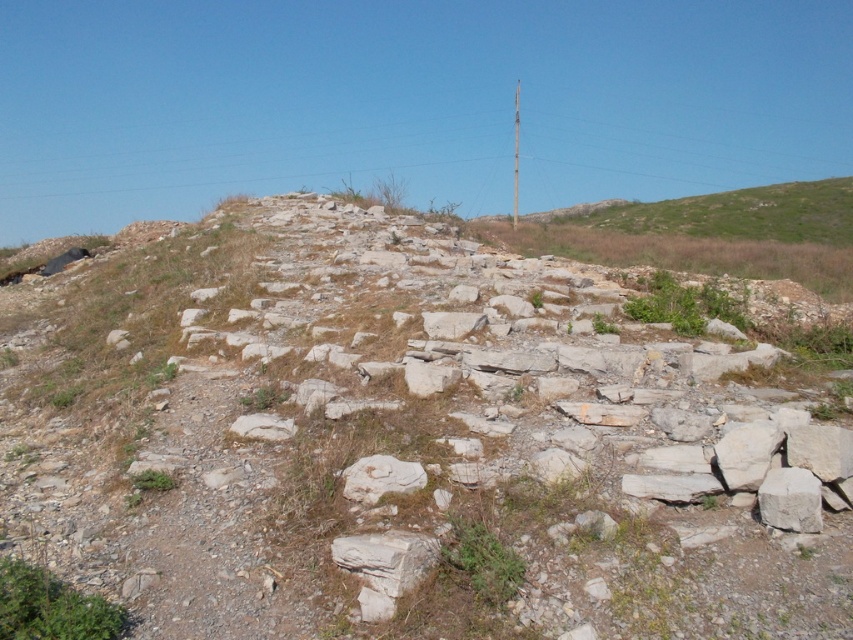
Question: Which is nearer to the gray stone rubble at center?

Choices:
 (A) green leafy grass at lower left
 (B) green grassy at center

Answer: (B)

Question: Which point is closer to the camera?

Choices:
 (A) (476, 524)
 (B) (21, 625)
 (C) (142, 547)

Answer: (B)

Question: Which of the following is the farthest from the observer?

Choices:
 (A) (454, 516)
 (B) (57, 611)
 (C) (566, 428)

Answer: (C)

Question: Can you confirm if gray stone rubble at center is positioned below green leafy grass at lower left?

Choices:
 (A) yes
 (B) no

Answer: (B)

Question: Can you confirm if gray stone rubble at center is positioned below green leafy grass at lower left?

Choices:
 (A) no
 (B) yes

Answer: (A)

Question: Is gray stone rubble at center to the right of green leafy grass at lower left from the viewer's perspective?

Choices:
 (A) no
 (B) yes

Answer: (A)